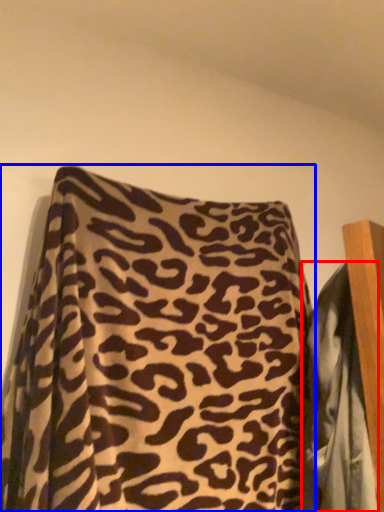
Question: Which point is further to the camera, blanket (highlighted by a red box) or pillow (highlighted by a blue box)?

Choices:
 (A) blanket
 (B) pillow

Answer: (A)